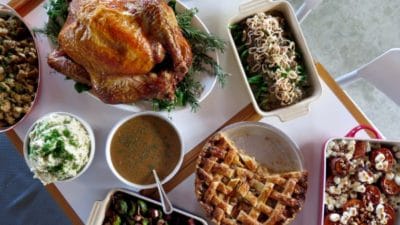
The height and width of the screenshot is (225, 400). I want to click on table, so click(x=354, y=107).